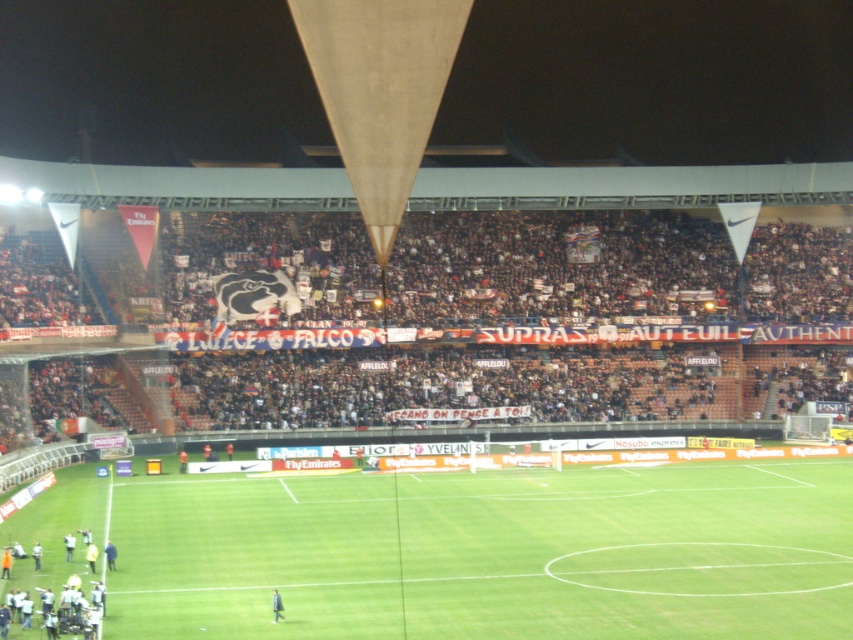
You are a photographer standing at the edge of the stadium. You want to capture a photo that includes both the green grass football field at center and the light yellow fabric at lower left. Based on their positions, which object should be placed on the right side of your photo?

The green grass football field at center is positioned on the right side of light yellow fabric at lower left, so in the photo, the green grass football field at center should be on the right side and the light yellow fabric at lower left on the left.

Consider the image. You are a photographer standing at the edge of the field. You want to take a photo of the dark blue uniform at center without the green grass football field at center appearing in the foreground. Is this possible?

The green grass football field at center is located above the dark blue uniform at center, so the field would block the view of the uniform. Therefore, it is not possible to take a photo of the dark blue uniform at center without the green grass football field at center appearing in the foreground.

You are a photographer positioned at the edge of the soccer field. You want to take a photo of the dark blue jacket at center and the light yellow fabric at lower left. Which object should you adjust your camera focus to first to ensure both are in the frame?

The dark blue jacket at center is in front of the light yellow fabric at lower left, so you should focus on the dark blue jacket at center first to ensure both are in the frame.